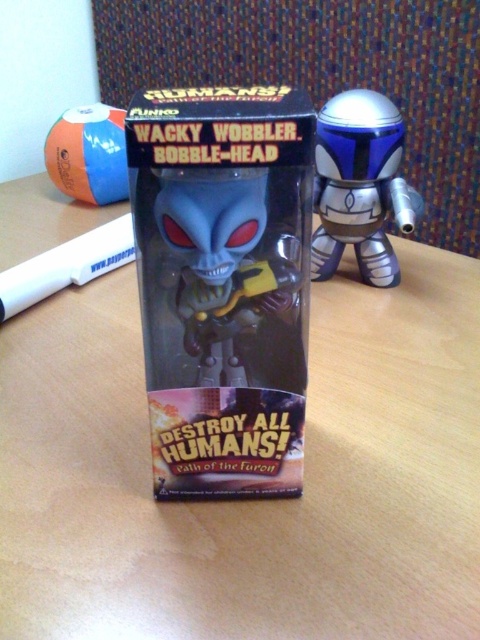
Does wooden table at center have a greater height compared to matte plastic box at center?

Indeed, wooden table at center has a greater height compared to matte plastic box at center.

Consider the image. Is wooden table at center wider than matte plastic box at center?

Indeed, wooden table at center has a greater width compared to matte plastic box at center.

Between point (91, 404) and point (223, 360), which one is positioned behind?

Positioned behind is point (91, 404).

Image resolution: width=480 pixels, height=640 pixels. In order to click on wooden table at center in this screenshot , I will do `click(249, 500)`.

Which is above, metallic blue helmet at upper right or orange rubber ball at upper left?

orange rubber ball at upper left is higher up.

You are a GUI agent. You are given a task and a screenshot of the screen. Output one action in this format:
    pyautogui.click(x=<x>, y=<y>)
    Task: Click on the metallic blue helmet at upper right
    The height and width of the screenshot is (640, 480).
    Given the screenshot: What is the action you would take?
    pyautogui.click(x=360, y=186)

This screenshot has height=640, width=480. I want to click on metallic blue helmet at upper right, so click(x=360, y=186).

Which is below, matte plastic box at center or orange rubber ball at upper left?

Positioned lower is matte plastic box at center.

You are a GUI agent. You are given a task and a screenshot of the screen. Output one action in this format:
    pyautogui.click(x=<x>, y=<y>)
    Task: Click on the matte plastic box at center
    Image resolution: width=480 pixels, height=640 pixels.
    Given the screenshot: What is the action you would take?
    pyautogui.click(x=223, y=284)